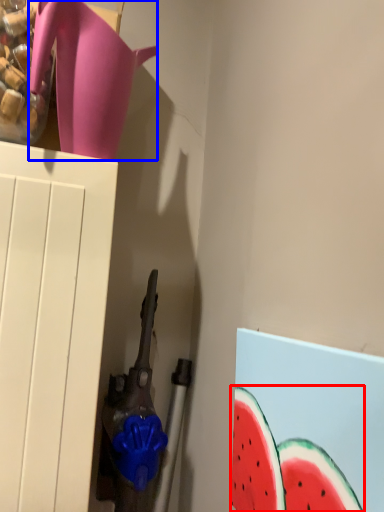
Question: Which of the following is the farthest to the observer, watermelon (highlighted by a red box) or jug (highlighted by a blue box)?

Choices:
 (A) watermelon
 (B) jug

Answer: (B)